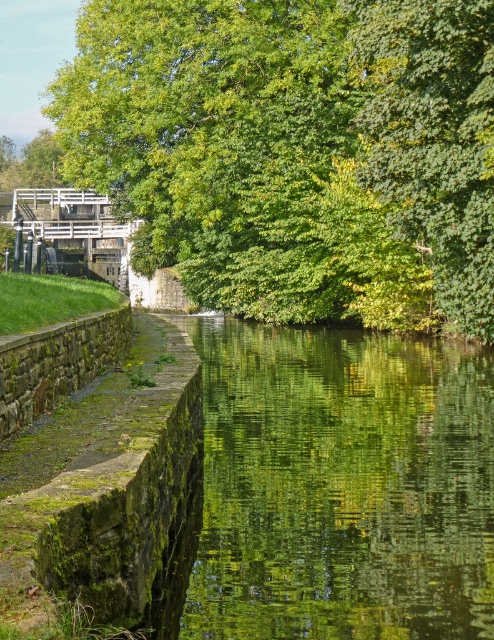
Is green mossy stone at lower left smaller than green mossy stone at left?

No.

Consider the image. Which is more to the right, green mossy stone at lower left or green mossy stone at left?

From the viewer's perspective, green mossy stone at lower left appears more on the right side.

Which is in front, point (216, 394) or point (99, 460)?

Point (99, 460) is more forward.

The image size is (494, 640). Identify the location of green mossy stone at lower left. (341, 484).

Does green mossy stone at lower left have a lesser height compared to green leafy tree at upper left?

Indeed, green mossy stone at lower left has a lesser height compared to green leafy tree at upper left.

Between point (345, 500) and point (13, 180), which one is positioned in front?

Point (345, 500) is in front.

Image resolution: width=494 pixels, height=640 pixels. I want to click on green mossy stone at lower left, so click(x=341, y=484).

Can you confirm if green leafy tree at upper center is bigger than green leafy tree at upper left?

Yes.

Is point (370, 26) farther from camera compared to point (53, 182)?

That is False.

Identify the location of green leafy tree at upper center. This screenshot has width=494, height=640. (295, 150).